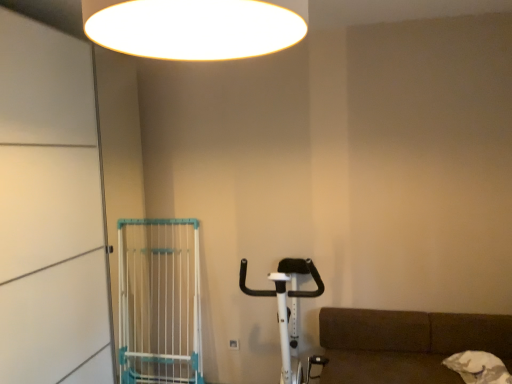
You are a GUI agent. You are given a task and a screenshot of the screen. Output one action in this format:
    pyautogui.click(x=<x>, y=<y>)
    Task: Click on the white plastic baby carriage at center-right
    The image size is (512, 384).
    Given the screenshot: What is the action you would take?
    pyautogui.click(x=287, y=308)

What do you see at coordinates (192, 28) in the screenshot?
I see `white glossy ceiling light at upper center` at bounding box center [192, 28].

Locate an element on the screen. The width and height of the screenshot is (512, 384). white plastic screen door at left is located at coordinates click(x=50, y=211).

This screenshot has height=384, width=512. Identify the location of white plastic gate at left. (159, 301).

This screenshot has height=384, width=512. What are the coordinates of `white plastic baby carriage at center-right` in the screenshot? It's located at (287, 308).

Is point (298, 261) closer to camera compared to point (186, 14)?

No, it is behind (186, 14).

What are the coordinates of `lamp that is above the white plastic baby carriage at center-right (from the image's perspective)` in the screenshot? It's located at (192, 28).

Can you confirm if white plastic baby carriage at center-right is bigger than white glossy ceiling light at upper center?

Yes.

Considering the sizes of white plastic baby carriage at center-right and white glossy ceiling light at upper center in the image, is white plastic baby carriage at center-right wider or thinner than white glossy ceiling light at upper center?

white plastic baby carriage at center-right is wider than white glossy ceiling light at upper center.

Does white plastic baby carriage at center-right come behind white plastic screen door at left?

Yes, white plastic baby carriage at center-right is further from the viewer.

From the image's perspective, relative to white plastic screen door at left, is white plastic baby carriage at center-right above or below?

white plastic baby carriage at center-right is situated lower than white plastic screen door at left in the image.

Which of these two, white plastic baby carriage at center-right or white plastic screen door at left, is thinner?

With smaller width is white plastic screen door at left.

Are white plastic baby carriage at center-right and white plastic screen door at left beside each other?

No, white plastic baby carriage at center-right is not beside white plastic screen door at left.

Could you tell me if white glossy ceiling light at upper center is facing white plastic baby carriage at center-right?

No, white glossy ceiling light at upper center does not turn towards white plastic baby carriage at center-right.

Which of these two, white glossy ceiling light at upper center or white plastic baby carriage at center-right, stands shorter?

white glossy ceiling light at upper center.

From a real-world perspective, between white glossy ceiling light at upper center and white plastic baby carriage at center-right, who is vertically higher?

white glossy ceiling light at upper center.

Is white glossy ceiling light at upper center smaller than white plastic baby carriage at center-right?

Correct, white glossy ceiling light at upper center occupies less space than white plastic baby carriage at center-right.

Locate an element on the screen. The height and width of the screenshot is (384, 512). screen door lying above the white plastic baby carriage at center-right (from the image's perspective) is located at coordinates (50, 211).

Which is more to the right, white plastic screen door at left or white plastic baby carriage at center-right?

From the viewer's perspective, white plastic baby carriage at center-right appears more on the right side.

Is white plastic screen door at left with white plastic baby carriage at center-right?

white plastic screen door at left and white plastic baby carriage at center-right are not in contact.

Relative to white plastic screen door at left, is white plastic gate at left in front or behind?

Visually, white plastic gate at left is located behind white plastic screen door at left.

Looking at this image, from the image's perspective, does white plastic gate at left appear lower than white plastic screen door at left?

Correct, white plastic gate at left appears lower than white plastic screen door at left in the image.

Is white plastic gate at left directly adjacent to white plastic screen door at left?

No, white plastic gate at left is not next to white plastic screen door at left.

Considering the relative sizes of white plastic gate at left and white plastic screen door at left in the image provided, is white plastic gate at left bigger than white plastic screen door at left?

Actually, white plastic gate at left might be smaller than white plastic screen door at left.

From a real-world perspective, is white plastic baby carriage at center-right on white fabric bag at lower right?

Yes, from a real-world perspective, white plastic baby carriage at center-right is over white fabric bag at lower right

Could you tell me if white plastic baby carriage at center-right is turned towards white fabric bag at lower right?

No, white plastic baby carriage at center-right is not oriented towards white fabric bag at lower right.

Is point (283, 304) in front of point (505, 376)?

Yes.

Would you say white plastic baby carriage at center-right is outside white fabric bag at lower right?

white plastic baby carriage at center-right is positioned outside white fabric bag at lower right.

Based on their positions, is white plastic baby carriage at center-right located to the left or right of white plastic gate at left?

white plastic baby carriage at center-right is positioned on white plastic gate at left's right side.

From the image's perspective, which is below, white plastic baby carriage at center-right or white plastic gate at left?

white plastic baby carriage at center-right, from the image's perspective.

At what (x,y) coordinates should I click in order to perform the action: click on cage behind the white plastic baby carriage at center-right. Please return your answer as a coordinate pair (x, y). Looking at the image, I should click on (159, 301).

Considering the sizes of objects white plastic baby carriage at center-right and white plastic gate at left in the image provided, who is smaller, white plastic baby carriage at center-right or white plastic gate at left?

Smaller between the two is white plastic gate at left.

What are the coordinates of `lamp lying on the left of white plastic baby carriage at center-right` in the screenshot? It's located at (192, 28).

Identify the location of baby carriage beneath the white plastic screen door at left (from a real-world perspective). (287, 308).

Which object lies nearer to the anchor point white plastic baby carriage at center-right, white fabric bag at lower right or white glossy ceiling light at upper center?

white fabric bag at lower right is closer to white plastic baby carriage at center-right.

From the image, which object appears to be farther from white glossy ceiling light at upper center, white plastic screen door at left or white fabric bag at lower right?

white fabric bag at lower right is positioned further to the anchor white glossy ceiling light at upper center.

Based on the photo, estimate the real-world distances between objects in this image. Which object is closer to white glossy ceiling light at upper center, white plastic baby carriage at center-right or white plastic gate at left?

white plastic baby carriage at center-right.

Looking at the image, which one is located closer to white plastic screen door at left, white fabric bag at lower right or white glossy ceiling light at upper center?

Based on the image, white glossy ceiling light at upper center appears to be nearer to white plastic screen door at left.

Estimate the real-world distances between objects in this image. Which object is further from white plastic gate at left, white plastic baby carriage at center-right or white glossy ceiling light at upper center?

Based on the image, white glossy ceiling light at upper center appears to be further to white plastic gate at left.

Looking at the image, which one is located closer to white plastic gate at left, white plastic baby carriage at center-right or white plastic screen door at left?

The object closer to white plastic gate at left is white plastic baby carriage at center-right.

When comparing their distances from white fabric bag at lower right, does white plastic baby carriage at center-right or white plastic screen door at left seem further?

white plastic screen door at left is positioned further to the anchor white fabric bag at lower right.

Considering their positions, is white plastic gate at left positioned further to white glossy ceiling light at upper center than white plastic screen door at left?

white plastic gate at left lies further to white glossy ceiling light at upper center than the other object.

This screenshot has width=512, height=384. Find the location of `baby carriage between white plastic screen door at left and white plastic gate at left along the z-axis`. baby carriage between white plastic screen door at left and white plastic gate at left along the z-axis is located at coordinates (287, 308).

Where is `cage between white plastic screen door at left and white fabric bag at lower right from left to right`? This screenshot has height=384, width=512. cage between white plastic screen door at left and white fabric bag at lower right from left to right is located at coordinates (159, 301).

Locate an element on the screen. The height and width of the screenshot is (384, 512). dog between white glossy ceiling light at upper center and white plastic gate at left in the front-back direction is located at coordinates (478, 367).

Locate an element on the screen. This screenshot has width=512, height=384. baby carriage between white glossy ceiling light at upper center and white fabric bag at lower right in the vertical direction is located at coordinates (287, 308).